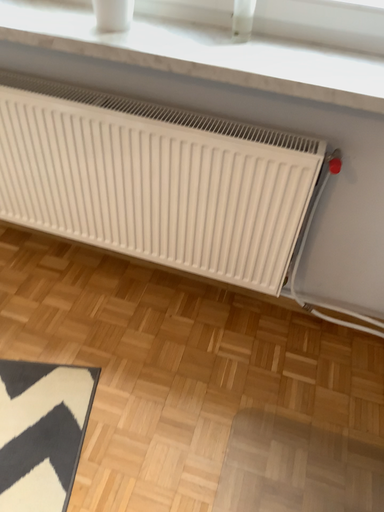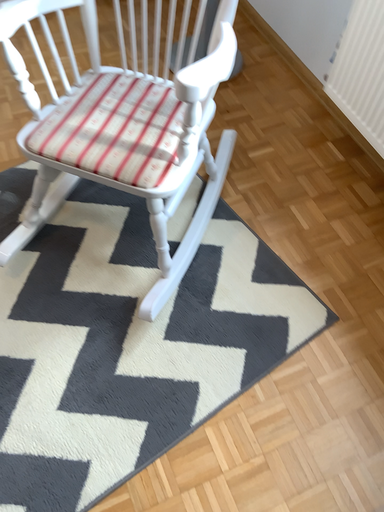
Question: How did the camera likely rotate when shooting the video?

Choices:
 (A) rotated right
 (B) rotated left

Answer: (B)